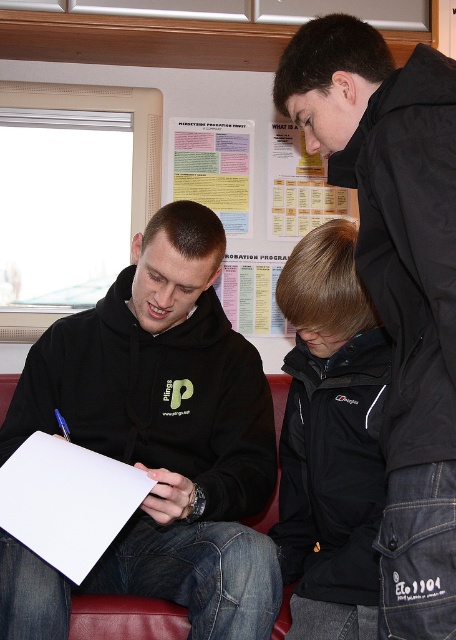
You are standing in the room and want to hand a document to the person wearing the black matte hoodie at center. However, there is a yellow paper poster at upper center blocking your path. Can you walk around the poster to reach the hoodie person without moving the poster?

The black matte hoodie at center is to the left of the yellow paper poster at upper center, so you can walk around the poster to the left side to reach the hoodie person without moving the poster.